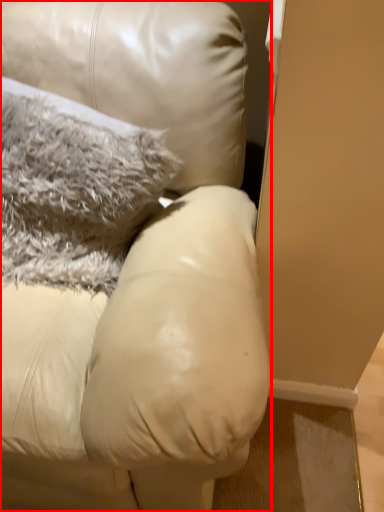
Question: From the image's perspective, where is furniture (annotated by the red box) located relative to pillow?

Choices:
 (A) above
 (B) below

Answer: (B)